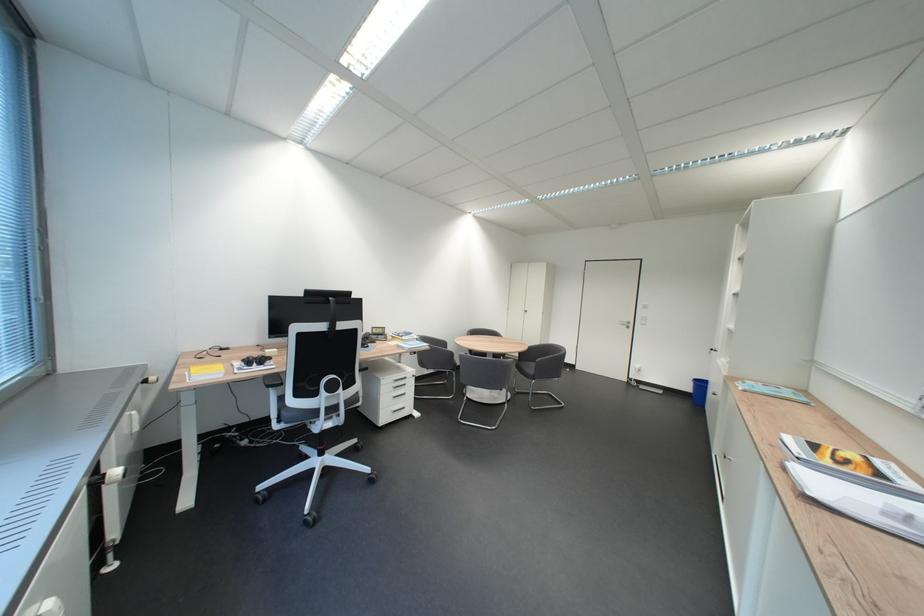
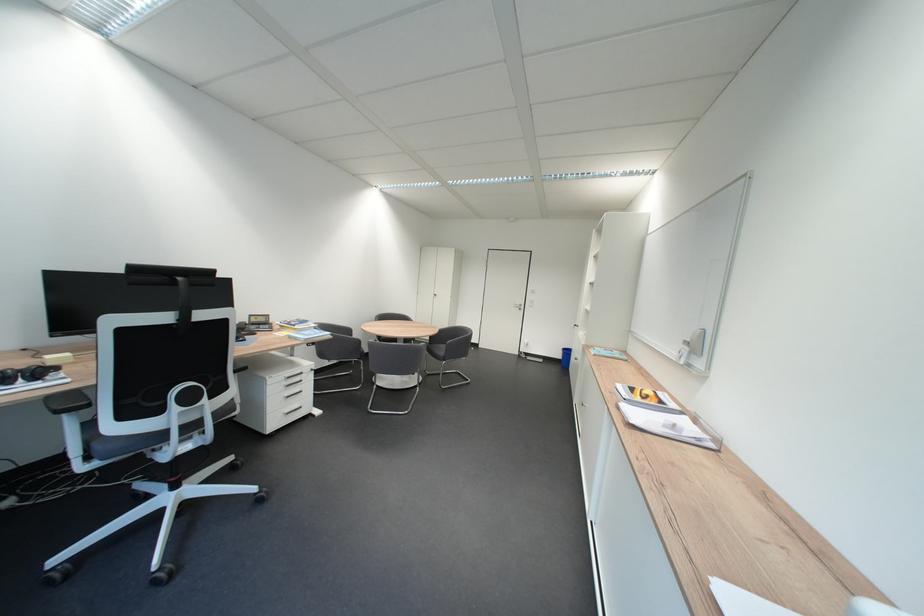
Where in the second image is the point corresponding to the point at 435,359 from the first image?

(334, 350)